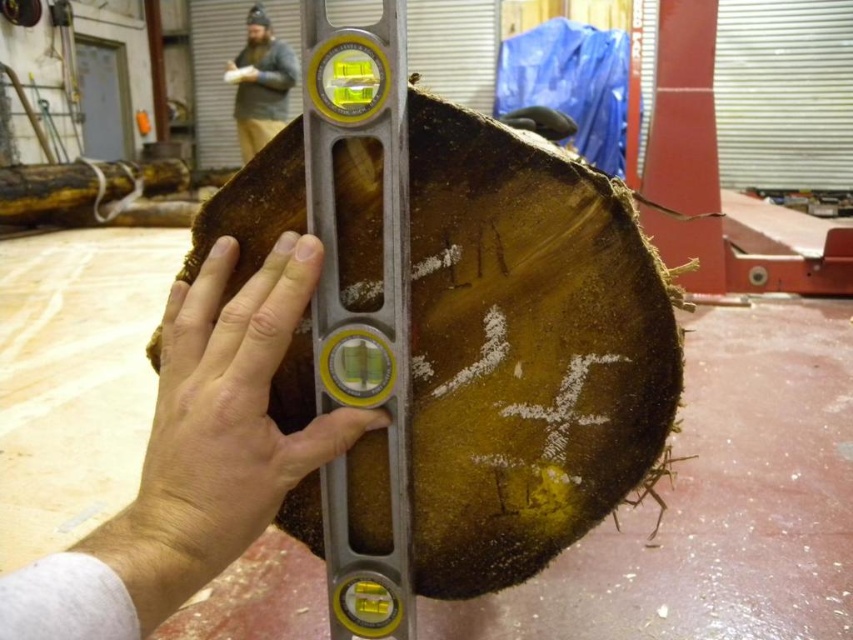
You are a carpenter trying to determine if the brown rough wood at center is stable enough to place a heavy tool on. Based on the position of the bearded man at upper left, can you tell if the wood is level?

The brown rough wood at center is positioned under bearded man at upper left, but the description does not provide information about the wood being level. The metal level in the image might indicate alignment, but the objects description does not mention its reading. Therefore, it is unclear if the wood is level based solely on the given information.

You are an architect designing a new wooden structure. You have a piece of brown rough wood at center and a bearded man at upper left. Which object is narrower in width?

The brown rough wood at center has a lesser width compared to the bearded man at upper left, so the brown rough wood at center is narrower in width.